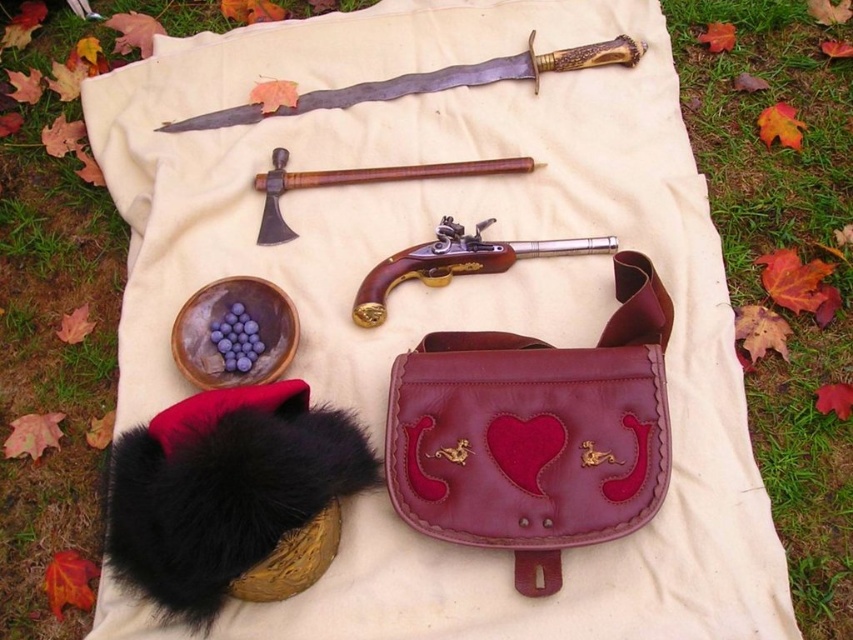
Question: Does polished brass flintlock pistol at upper center have a smaller size compared to wooden handle at upper center?

Choices:
 (A) no
 (B) yes

Answer: (A)

Question: Can you confirm if green grass at upper left is positioned above polished wood and brass pistol at center?

Choices:
 (A) yes
 (B) no

Answer: (B)

Question: Is green grass at lower right to the left of polished brass flintlock pistol at upper center from the viewer's perspective?

Choices:
 (A) yes
 (B) no

Answer: (B)

Question: Which object is positioned farthest from the green grass at upper left?

Choices:
 (A) polished wood and brass pistol at center
 (B) green grass at lower right
 (C) black fuzzy hat at lower left

Answer: (B)

Question: Considering the real-world distances, which object is closest to the black fuzzy hat at lower left?

Choices:
 (A) green grass at lower right
 (B) green grass at upper left

Answer: (B)

Question: Among these objects, which one is farthest from the camera?

Choices:
 (A) black fuzzy hat at lower left
 (B) green grass at upper left
 (C) polished brass flintlock pistol at upper center
 (D) wooden handle at upper center

Answer: (C)